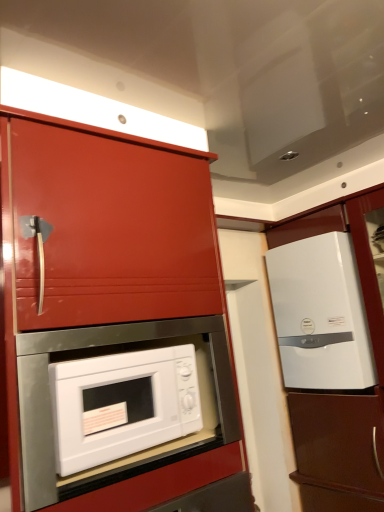
Question: Which is correct: glossy red cabinet at center, the 1th cabinetry when ordered from front to back, is inside white glossy cabinet at right, marked as the 1th cabinetry in a right-to-left arrangement, or outside of it?

Choices:
 (A) outside
 (B) inside

Answer: (A)

Question: From a real-world perspective, relative to white glossy cabinet at right, the 1th cabinetry from the back, is glossy red cabinet at center, arranged as the second cabinetry when viewed from the right, vertically above or below?

Choices:
 (A) above
 (B) below

Answer: (A)

Question: Which is farther from the white glossy microwave at center?

Choices:
 (A) white glossy refrigerator at right
 (B) glossy red cabinet at center, arranged as the second cabinetry when viewed from the right
 (C) white glossy cabinet at right, marked as the 1th cabinetry in a right-to-left arrangement

Answer: (C)

Question: Considering the real-world distances, which object is farthest from the white glossy microwave at center?

Choices:
 (A) white glossy refrigerator at right
 (B) white glossy cabinet at right, which is counted as the 2th cabinetry, starting from the front
 (C) glossy red cabinet at center, arranged as the second cabinetry when viewed from the right

Answer: (B)